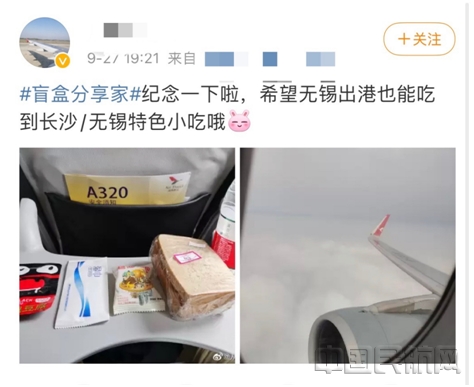
The image size is (474, 387). I want to click on bottle of drink, so click(x=225, y=247).